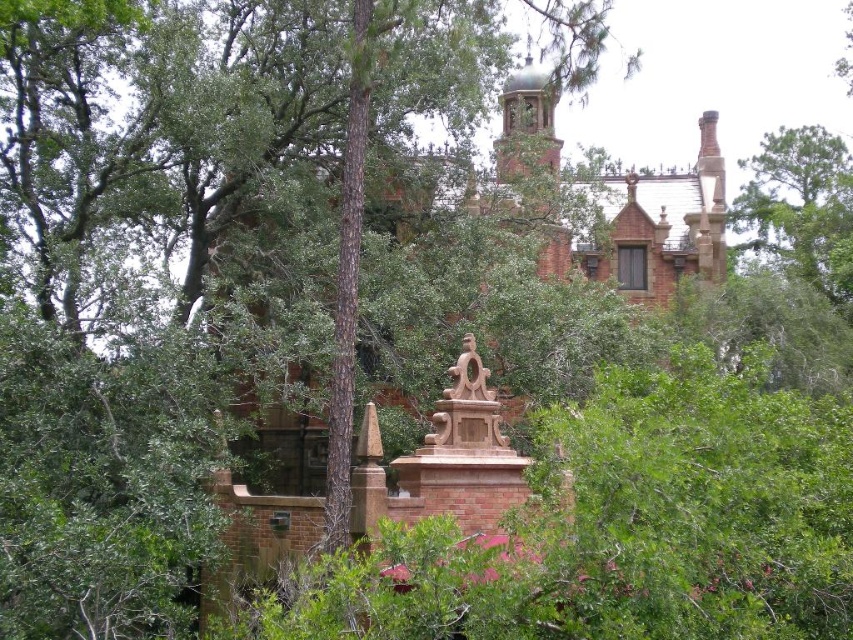
You are an architect planning to place a new bench in this garden scene. The bench must be positioned between the green leafy tree at upper right and the carved stone statue at center. Considering their widths, which object should the bench be closer to to ensure it doesn

The bench should be placed closer to the carved stone statue at center because the green leafy tree at upper right is wider than the carved stone statue at center. This placement ensures the bench is positioned in a narrower space between them.

You are an architect designing a new garden layout and need to ensure proper spacing between the green leafy tree at upper right and the carved stone statue at center. Based on their sizes, which object should be placed farther back to maintain visual balance?

The green leafy tree at upper right is taller than the carved stone statue at center, so to maintain visual balance, the green leafy tree at upper right should be placed farther back since taller objects are typically positioned at a distance to create depth and balance in garden layouts.

You are standing in the scene described. You want to point to the location marked by the coordinates point (799, 209). Which object in the scene would you be pointing at?

You would be pointing at the green leafy tree at upper right, as the coordinates point (799, 209) are located on that object.